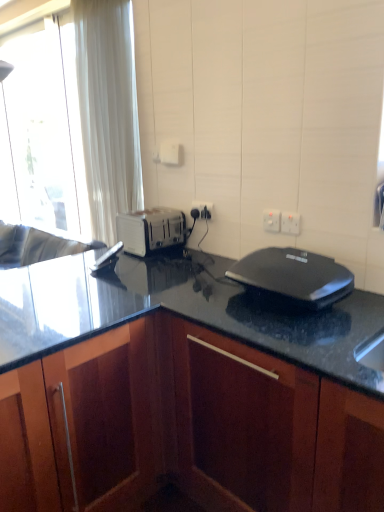
The height and width of the screenshot is (512, 384). In order to click on white plastic toaster at center in this screenshot , I will do `click(151, 230)`.

The height and width of the screenshot is (512, 384). Describe the element at coordinates (76, 122) in the screenshot. I see `white curtain at left` at that location.

The image size is (384, 512). I want to click on white curtain at left, so click(x=76, y=122).

Locate an element on the screen. The width and height of the screenshot is (384, 512). black plastic sandwich maker at center is located at coordinates (293, 277).

Identify the location of white plastic electric outlet at upper right, which ranks as the first electric outlet in right-to-left order. The height and width of the screenshot is (512, 384). (290, 223).

Is white plastic electric outlet at upper right, arranged as the 1th electric outlet when viewed from the front, turned away from white plastic toaster at center?

That's not correct — white plastic electric outlet at upper right, arranged as the 1th electric outlet when viewed from the front, is not looking away from white plastic toaster at center.

Which object is wider, white plastic electric outlet at upper right, which ranks as the first electric outlet in right-to-left order, or white plastic toaster at center?

With larger width is white plastic toaster at center.

From a real-world perspective, is white plastic electric outlet at upper right, positioned as the 3th electric outlet in left-to-right order, physically above white plastic toaster at center?

Indeed, from a real-world perspective, white plastic electric outlet at upper right, positioned as the 3th electric outlet in left-to-right order, stands above white plastic toaster at center.

From the picture: Can you confirm if white plastic electric outlet at upper right, which ranks as the first electric outlet in right-to-left order, is shorter than white plastic toaster at center?

Indeed, white plastic electric outlet at upper right, which ranks as the first electric outlet in right-to-left order, has a lesser height compared to white plastic toaster at center.

Are white plastic electric outlet at center, the third electric outlet viewed from the right, and white plastic toaster at center beside each other?

They are not placed beside each other.

Which object is more forward, white plastic electric outlet at center, the third electric outlet viewed from the right, or white plastic toaster at center?

white plastic toaster at center.

From a real-world perspective, is white plastic electric outlet at center, arranged as the 3th electric outlet when viewed from the front, over white plastic toaster at center?

Yes.

Does white plastic electric outlet at center, arranged as the 3th electric outlet when viewed from the front, have a greater height compared to white plastic electric outlet at upper right, arranged as the 1th electric outlet when viewed from the front?

No, white plastic electric outlet at center, arranged as the 3th electric outlet when viewed from the front, is not taller than white plastic electric outlet at upper right, arranged as the 1th electric outlet when viewed from the front.

Is white plastic electric outlet at center, the third electric outlet viewed from the right, beside white plastic electric outlet at upper right, arranged as the 1th electric outlet when viewed from the front?

No, white plastic electric outlet at center, the third electric outlet viewed from the right, is not beside white plastic electric outlet at upper right, arranged as the 1th electric outlet when viewed from the front.

From a real-world perspective, is white plastic electric outlet at center, arranged as the 3th electric outlet when viewed from the front, positioned above or below white plastic electric outlet at upper right, positioned as the 3th electric outlet in left-to-right order?

white plastic electric outlet at center, arranged as the 3th electric outlet when viewed from the front, is below white plastic electric outlet at upper right, positioned as the 3th electric outlet in left-to-right order.

Based on their positions, is white plastic electric outlet at center, arranged as the 3th electric outlet when viewed from the front, located to the left or right of white plastic electric outlet at upper right, which ranks as the first electric outlet in right-to-left order?

white plastic electric outlet at center, arranged as the 3th electric outlet when viewed from the front, is to the left of white plastic electric outlet at upper right, which ranks as the first electric outlet in right-to-left order.

In the scene shown: From the image's perspective, is white plastic electric outlet at upper right, acting as the third electric outlet starting from the back, located above black plastic sandwich maker at center?

Yes.

You are a GUI agent. You are given a task and a screenshot of the screen. Output one action in this format:
    pyautogui.click(x=<x>, y=<y>)
    Task: Click on the 1st electric outlet behind the black plastic sandwich maker at center, starting your count from the anchor
    The image size is (384, 512).
    Given the screenshot: What is the action you would take?
    pyautogui.click(x=290, y=223)

Which object is positioned more to the right, white plastic electric outlet at upper right, arranged as the 1th electric outlet when viewed from the front, or black plastic sandwich maker at center?

white plastic electric outlet at upper right, arranged as the 1th electric outlet when viewed from the front, is more to the right.

What's the angular difference between white plastic electric outlet at upper right, positioned as the 3th electric outlet in left-to-right order, and black plastic sandwich maker at center's facing directions?

There is a 1.54-degree angle between the facing directions of white plastic electric outlet at upper right, positioned as the 3th electric outlet in left-to-right order, and black plastic sandwich maker at center.

Is white plastic electric outlet at center, arranged as the 3th electric outlet when viewed from the front, in contact with white plastic electric outlet at upper right, the second electric outlet viewed from the left?

white plastic electric outlet at center, arranged as the 3th electric outlet when viewed from the front, is not next to white plastic electric outlet at upper right, the second electric outlet viewed from the left, and they're not touching.

This screenshot has height=512, width=384. What are the coordinates of `electric outlet located behind the white plastic electric outlet at upper right, acting as the 2th electric outlet starting from the right` in the screenshot? It's located at [203, 209].

Does white plastic electric outlet at center, the third electric outlet viewed from the right, contain white plastic electric outlet at upper right, acting as the 2th electric outlet starting from the right?

No, white plastic electric outlet at center, the third electric outlet viewed from the right, does not contain white plastic electric outlet at upper right, acting as the 2th electric outlet starting from the right.

Considering the positions of objects white plastic electric outlet at center, arranged as the 3th electric outlet when viewed from the front, and white plastic electric outlet at upper right, the second electric outlet viewed from the left, in the image provided, who is in front, white plastic electric outlet at center, arranged as the 3th electric outlet when viewed from the front, or white plastic electric outlet at upper right, the second electric outlet viewed from the left,?

white plastic electric outlet at upper right, the second electric outlet viewed from the left, is more forward.

Is white plastic electric outlet at upper right, the second electric outlet viewed from the left, inside the boundaries of white curtain at left, or outside?

white plastic electric outlet at upper right, the second electric outlet viewed from the left, cannot be found inside white curtain at left.

Would you consider white plastic electric outlet at upper right, which is counted as the 2th electric outlet, starting from the back, to be distant from white curtain at left?

Yes, white plastic electric outlet at upper right, which is counted as the 2th electric outlet, starting from the back, and white curtain at left are quite far apart.

Can you confirm if white plastic electric outlet at upper right, which is counted as the 2th electric outlet, starting from the back, is wider than white curtain at left?

No.

Which electric outlet is the 2nd one when counting from the front of the white curtain at left? Please provide its 2D coordinates.

[(271, 220)]

Is dark wood cabinet at center a part of white plastic electric outlet at center, which is counted as the first electric outlet, starting from the left?

No, white plastic electric outlet at center, which is counted as the first electric outlet, starting from the left, does not contain dark wood cabinet at center.

Between white plastic electric outlet at center, which is counted as the first electric outlet, starting from the left, and dark wood cabinet at center, which one has larger width?

Wider between the two is dark wood cabinet at center.

From the image's perspective, which one is positioned higher, white plastic electric outlet at center, arranged as the 3th electric outlet when viewed from the front, or dark wood cabinet at center?

white plastic electric outlet at center, arranged as the 3th electric outlet when viewed from the front.

Considering the relative sizes of white plastic electric outlet at center, the third electric outlet viewed from the right, and dark wood cabinet at center in the image provided, is white plastic electric outlet at center, the third electric outlet viewed from the right, taller than dark wood cabinet at center?

In fact, white plastic electric outlet at center, the third electric outlet viewed from the right, may be shorter than dark wood cabinet at center.

Locate an element on the screen. This screenshot has height=512, width=384. the 3rd electric outlet located above the white plastic toaster at center (from a real-world perspective) is located at coordinates (290, 223).

Identify the location of toaster in front of the white plastic electric outlet at center, acting as the 1th electric outlet starting from the back. This screenshot has width=384, height=512. (151, 230).

When comparing their distances from black plastic sandwich maker at center, does white plastic electric outlet at upper right, arranged as the 1th electric outlet when viewed from the front, or white plastic toaster at center seem closer?

white plastic electric outlet at upper right, arranged as the 1th electric outlet when viewed from the front, lies closer to black plastic sandwich maker at center than the other object.

Consider the image. Which object lies nearer to the anchor point white plastic electric outlet at upper right, which is counted as the 2th electric outlet, starting from the back, white plastic electric outlet at upper right, which ranks as the first electric outlet in right-to-left order, or white curtain at left?

white plastic electric outlet at upper right, which ranks as the first electric outlet in right-to-left order, is closer to white plastic electric outlet at upper right, which is counted as the 2th electric outlet, starting from the back.

Considering their positions, is white plastic toaster at center positioned closer to black plastic sandwich maker at center than white plastic electric outlet at upper right, the second electric outlet viewed from the left?

white plastic electric outlet at upper right, the second electric outlet viewed from the left, is positioned closer to the anchor black plastic sandwich maker at center.

Estimate the real-world distances between objects in this image. Which object is further from white plastic electric outlet at center, the third electric outlet viewed from the right, white curtain at left or white plastic toaster at center?

white curtain at left is further to white plastic electric outlet at center, the third electric outlet viewed from the right.

Which object lies further to the anchor point white plastic electric outlet at upper right, which is counted as the 2th electric outlet, starting from the back, white plastic electric outlet at upper right, positioned as the 3th electric outlet in left-to-right order, or white plastic electric outlet at center, acting as the 1th electric outlet starting from the back?

Among the two, white plastic electric outlet at center, acting as the 1th electric outlet starting from the back, is located further to white plastic electric outlet at upper right, which is counted as the 2th electric outlet, starting from the back.

From the picture: Looking at the image, which one is located closer to white plastic toaster at center, dark wood cabinet at center or white plastic electric outlet at center, which is counted as the first electric outlet, starting from the left?

The object closer to white plastic toaster at center is white plastic electric outlet at center, which is counted as the first electric outlet, starting from the left.

Estimate the real-world distances between objects in this image. Which object is further from white plastic electric outlet at upper right, acting as the 2th electric outlet starting from the right, white curtain at left or white plastic electric outlet at center, which is counted as the first electric outlet, starting from the left?

white curtain at left is further to white plastic electric outlet at upper right, acting as the 2th electric outlet starting from the right.

Estimate the real-world distances between objects in this image. Which object is further from black plastic sandwich maker at center, dark wood cabinet at center or white plastic electric outlet at upper right, acting as the 2th electric outlet starting from the right?

dark wood cabinet at center is further to black plastic sandwich maker at center.

At what (x,y) coordinates should I click in order to perform the action: click on home appliance between dark wood cabinet at center and white plastic electric outlet at upper right, which is counted as the 2th electric outlet, starting from the back, along the z-axis. Please return your answer as a coordinate pair (x, y). This screenshot has width=384, height=512. Looking at the image, I should click on (293, 277).

Image resolution: width=384 pixels, height=512 pixels. I want to click on toaster positioned between black plastic sandwich maker at center and white plastic electric outlet at center, arranged as the 3th electric outlet when viewed from the front, from near to far, so click(151, 230).

Find the location of a particular element. toaster located between white curtain at left and white plastic electric outlet at upper right, which ranks as the first electric outlet in right-to-left order, in the left-right direction is located at coordinates (151, 230).

Where is `home appliance that lies between white curtain at left and dark wood cabinet at center from top to bottom`? home appliance that lies between white curtain at left and dark wood cabinet at center from top to bottom is located at coordinates (293, 277).